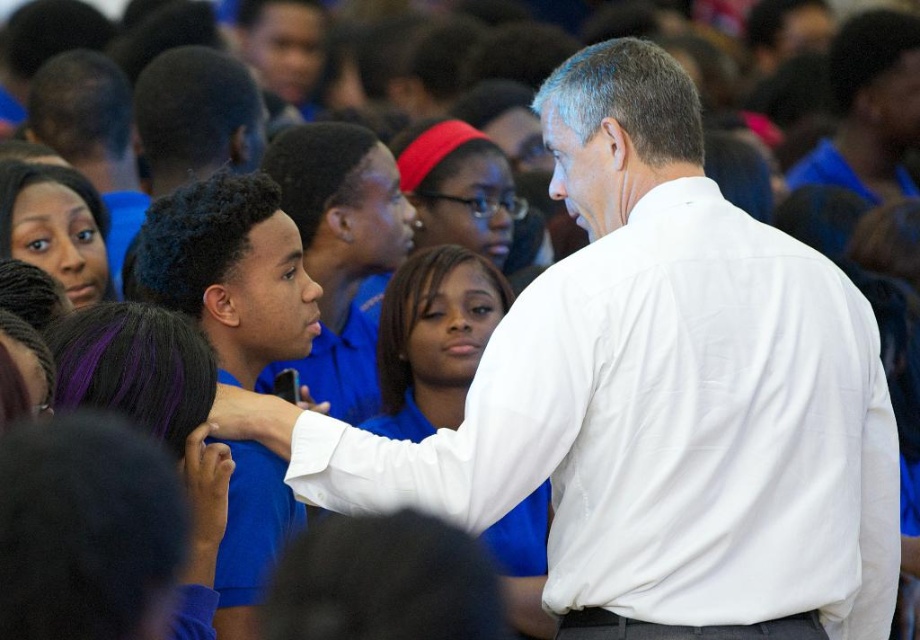
Question: Can you confirm if white smooth shirt at center is positioned below blue shirt at center?

Choices:
 (A) yes
 (B) no

Answer: (A)

Question: Is white smooth shirt at center to the right of blue shirt at center from the viewer's perspective?

Choices:
 (A) no
 (B) yes

Answer: (B)

Question: Does white smooth shirt at center have a lesser width compared to blue shirt at center?

Choices:
 (A) no
 (B) yes

Answer: (A)

Question: Which point is closer to the camera taking this photo?

Choices:
 (A) (715, 232)
 (B) (247, 344)

Answer: (A)

Question: Among these objects, which one is nearest to the camera?

Choices:
 (A) blue shirt at center
 (B) white smooth shirt at center

Answer: (B)

Question: Which point is farther to the camera?

Choices:
 (A) blue shirt at center
 (B) white smooth shirt at center

Answer: (A)